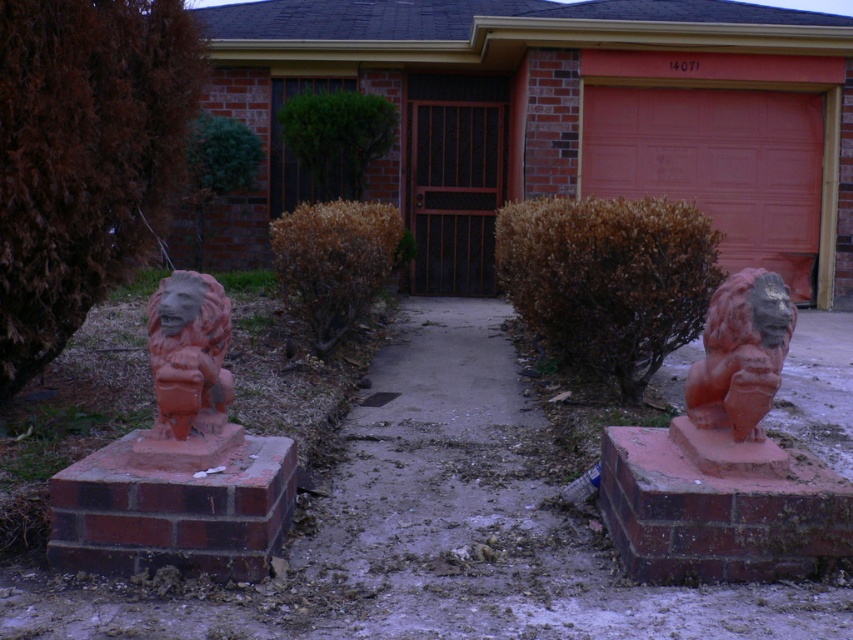
Question: Can you confirm if matte orange garage door at center is positioned below terracotta statue at right?

Choices:
 (A) no
 (B) yes

Answer: (A)

Question: Among these objects, which one is farthest from the camera?

Choices:
 (A) matte red garage door at center
 (B) brown metal/gate at center
 (C) matte terracotta lion at left

Answer: (B)

Question: Which point is closer to the camera?

Choices:
 (A) brown metal/gate at center
 (B) matte terracotta lion at left

Answer: (B)

Question: Considering the relative positions of matte orange garage door at center and matte terracotta lion at left in the image provided, where is matte orange garage door at center located with respect to matte terracotta lion at left?

Choices:
 (A) right
 (B) left

Answer: (A)

Question: Which point is farther to the camera?

Choices:
 (A) (155, 304)
 (B) (763, 122)

Answer: (B)

Question: Is matte orange garage door at center positioned in front of matte red garage door at center?

Choices:
 (A) no
 (B) yes

Answer: (A)